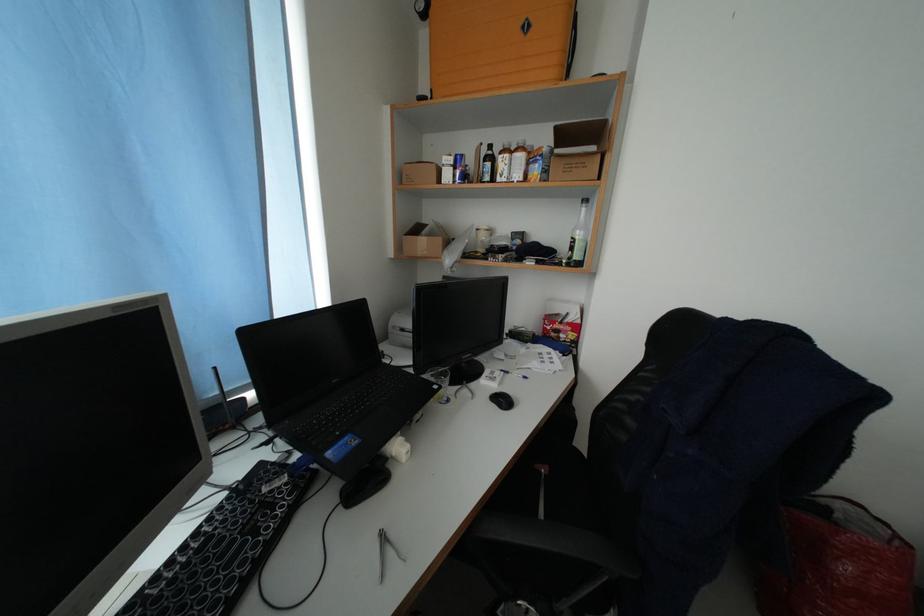
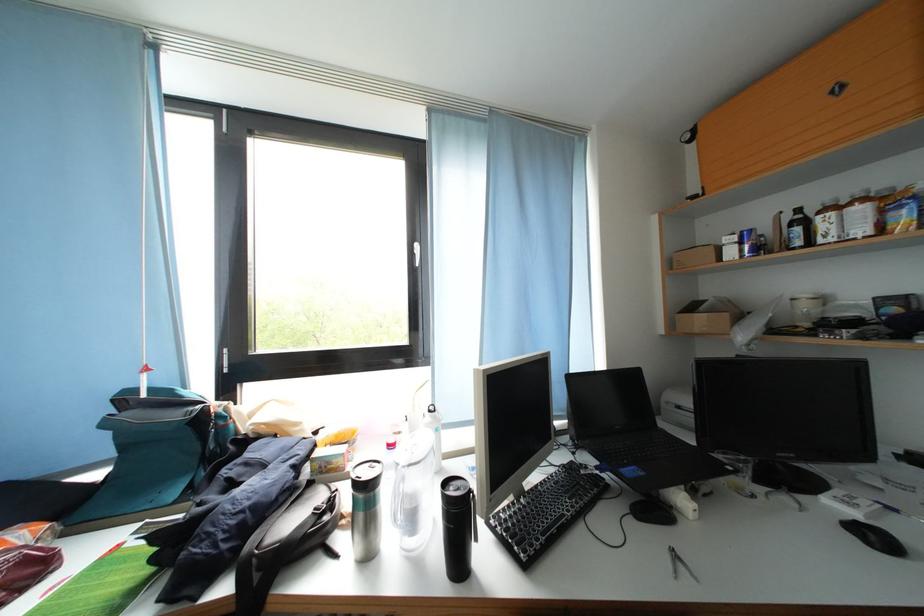
Where in the second image is the point corresponding to pixel 501 164 from the first image?

(812, 227)